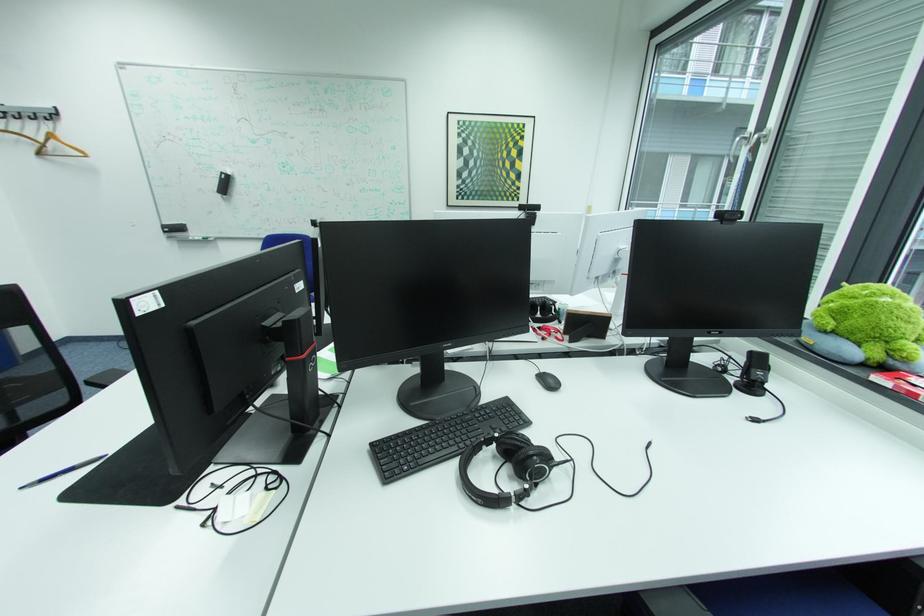
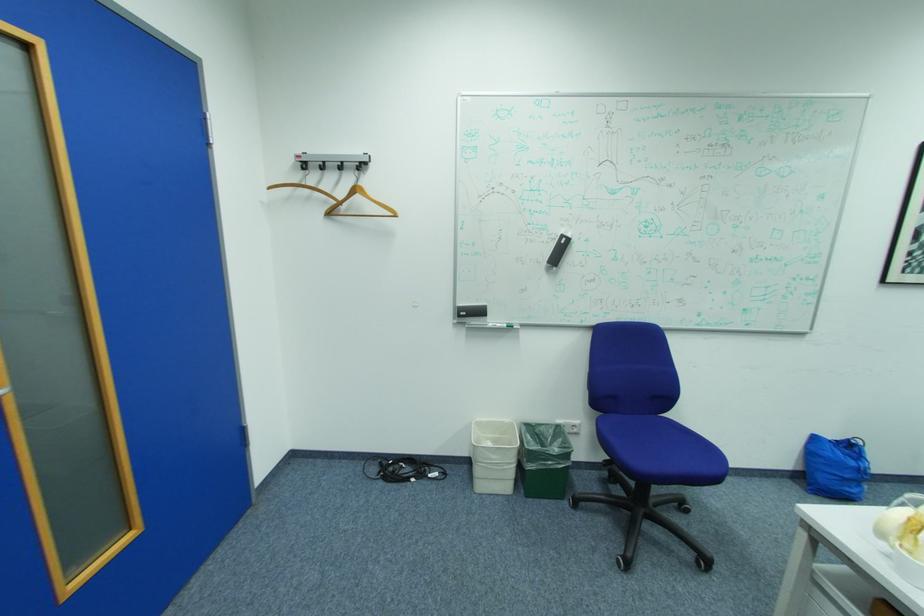
Locate, in the second image, the point that corresponds to the point at 62,140 in the first image.

(366, 197)